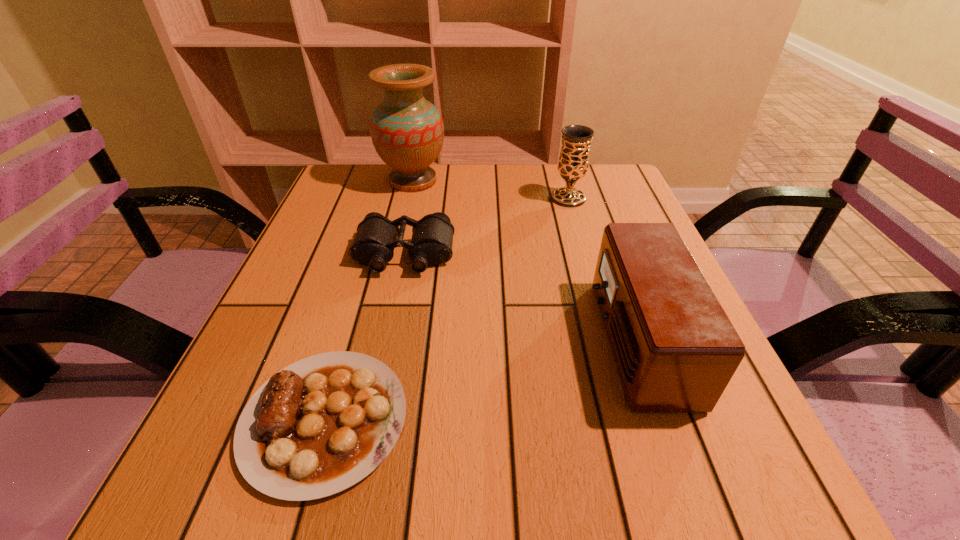
At what (x,y) coordinates should I click in order to perform the action: click on vase. Please return your answer as a coordinate pair (x, y). This screenshot has height=540, width=960. Looking at the image, I should click on (407, 131).

The image size is (960, 540). In order to click on the fourth shortest object in this screenshot , I will do 573,163.

Where is `radio receiver`? The image size is (960, 540). radio receiver is located at coordinates (675, 349).

Where is `binoculars`? binoculars is located at coordinates (432, 236).

This screenshot has width=960, height=540. Identify the location of the fourth tallest object. (432, 236).

The image size is (960, 540). I want to click on the shortest object, so click(x=322, y=424).

Image resolution: width=960 pixels, height=540 pixels. Find the location of `free space located on the front of the tallest object`. free space located on the front of the tallest object is located at coordinates (388, 289).

Find the location of a particular element. This screenshot has width=960, height=540. vacant area located on the back of the chalice is located at coordinates (563, 180).

The width and height of the screenshot is (960, 540). Identify the location of free space located on the front-facing side of the radio receiver. (426, 340).

Locate an element on the screen. The height and width of the screenshot is (540, 960). vacant space located on the front-facing side of the radio receiver is located at coordinates (426, 340).